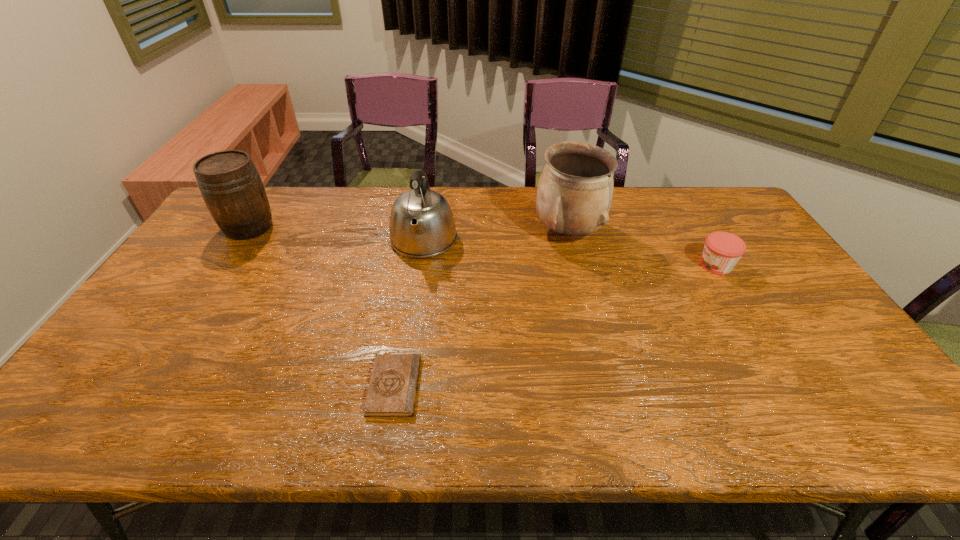
Where is `object that is at the far left corner`? The image size is (960, 540). object that is at the far left corner is located at coordinates (230, 185).

Where is `free space at the far edge`? Image resolution: width=960 pixels, height=540 pixels. free space at the far edge is located at coordinates (302, 207).

You are a GUI agent. You are given a task and a screenshot of the screen. Output one action in this format:
    pyautogui.click(x=<x>, y=<y>)
    Task: Click on the vacant space at the near edge of the desktop
    
    Given the screenshot: What is the action you would take?
    pyautogui.click(x=159, y=429)

The width and height of the screenshot is (960, 540). I want to click on blank space at the left edge, so click(x=185, y=277).

Identify the location of vacant point at the right edge. This screenshot has width=960, height=540. (769, 305).

I want to click on free space at the near left corner, so click(x=107, y=401).

Where is `empty location between the leftmost object and the kettle`? empty location between the leftmost object and the kettle is located at coordinates (336, 234).

The height and width of the screenshot is (540, 960). I want to click on free point between the jam and the shortest object, so 555,326.

Find the location of `empty location between the kettle and the fourth object from left to right`. empty location between the kettle and the fourth object from left to right is located at coordinates (496, 237).

Identify the location of free space between the rightmost object and the kettle. (570, 253).